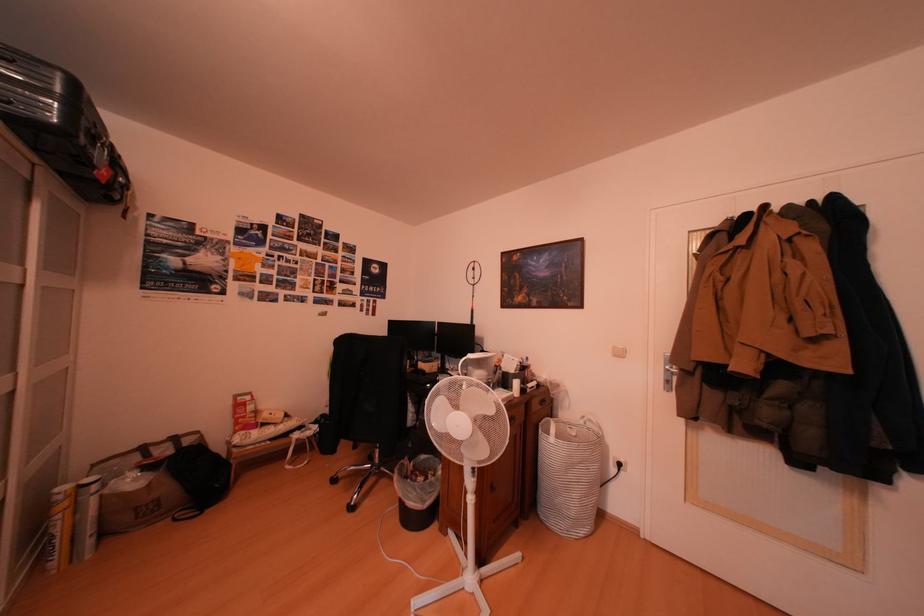
Locate an element on the screen. This screenshot has width=924, height=616. silver door handle is located at coordinates (667, 373).